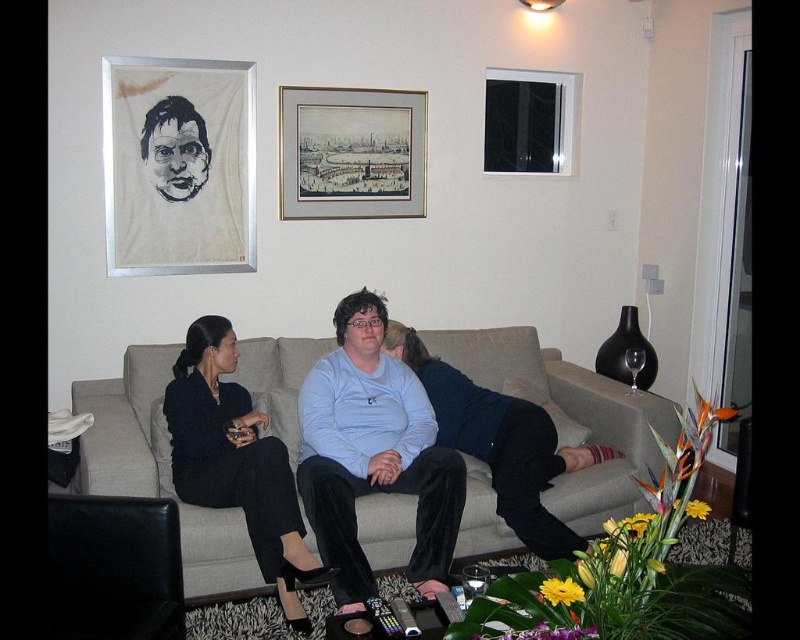
Question: Is light gray fabric couch at center in front of black fabric dress at center?

Choices:
 (A) yes
 (B) no

Answer: (B)

Question: Is light gray fabric couch at center smaller than black fabric dress at center?

Choices:
 (A) yes
 (B) no

Answer: (B)

Question: Observing the image, what is the correct spatial positioning of black fabric dress at center in reference to light blue sweater at center?

Choices:
 (A) above
 (B) below

Answer: (B)

Question: Which point appears farthest from the camera in this image?

Choices:
 (A) (426, 509)
 (B) (326, 148)
 (C) (308, 529)

Answer: (B)

Question: Among these objects, which one is nearest to the camera?

Choices:
 (A) gold-framed print at upper center
 (B) light blue sweater at center

Answer: (B)

Question: Based on their relative distances, which object is nearer to the black fabric dress at center?

Choices:
 (A) light blue cotton shirt at center
 (B) silver metallic picture frame at upper left
 (C) light blue sweater at center

Answer: (A)